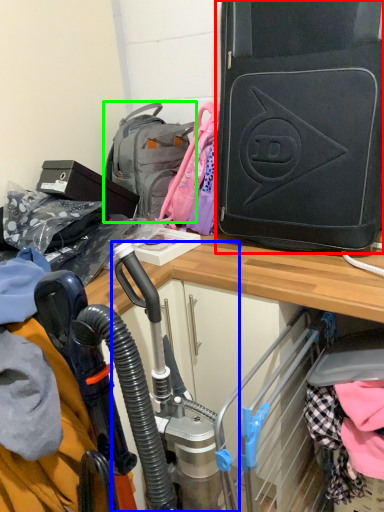
Question: Based on their relative distances, which object is nearer to luggage and bags (highlighted by a red box)? Choose from sport equipment (highlighted by a blue box) and backpack (highlighted by a green box).

Choices:
 (A) sport equipment
 (B) backpack

Answer: (B)